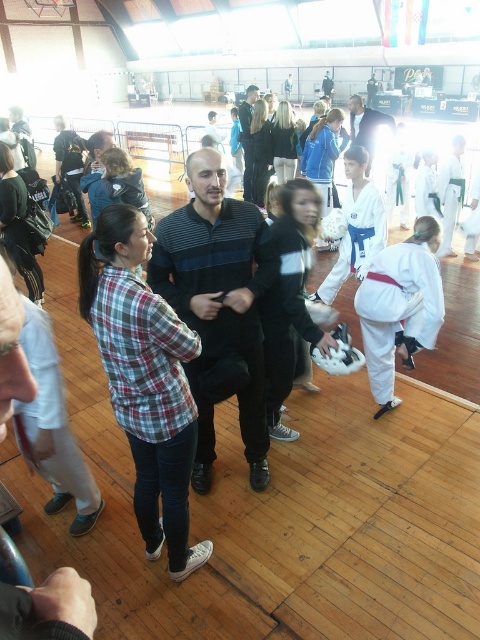
Can you confirm if matte black jacket at center is bigger than dark blue striped sweater at center?

Yes.

Does matte black jacket at center appear on the left side of dark blue striped sweater at center?

No, matte black jacket at center is not to the left of dark blue striped sweater at center.

Who is more distant from viewer, (389, 125) or (247, 182)?

Point (247, 182)

Where is `matte black jacket at center`? This screenshot has width=480, height=640. matte black jacket at center is located at coordinates (365, 125).

Which is in front, point (224, 339) or point (372, 157)?

Positioned in front is point (224, 339).

Does striped sweater at center appear under matte black jacket at center?

Indeed, striped sweater at center is positioned under matte black jacket at center.

Which is in front, point (200, 464) or point (367, 148)?

Point (200, 464) is more forward.

Locate an element on the screen. striped sweater at center is located at coordinates (217, 301).

Does striped sweater at center have a greater height compared to dark blue striped sweater at center?

No, striped sweater at center is not taller than dark blue striped sweater at center.

Identify the location of striped sweater at center. (217, 301).

You are a GUI agent. You are given a task and a screenshot of the screen. Output one action in this format:
    pyautogui.click(x=<x>, y=<y>)
    Task: Click on the striped sweater at center
    This screenshot has height=640, width=480.
    Given the screenshot: What is the action you would take?
    pyautogui.click(x=217, y=301)